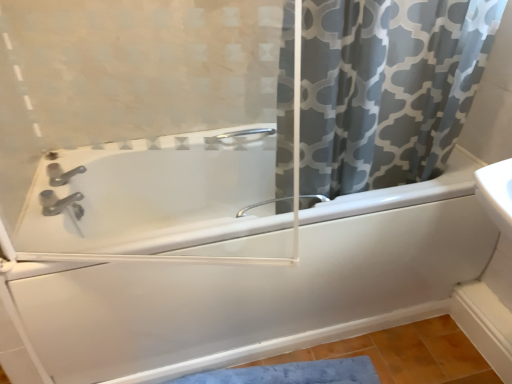
Question: Is satin nickel faucet at lower left aimed at gray printed fabric curtain at upper right?

Choices:
 (A) yes
 (B) no

Answer: (A)

Question: Is satin nickel faucet at lower left wider than gray printed fabric curtain at upper right?

Choices:
 (A) yes
 (B) no

Answer: (B)

Question: Considering the relative positions of satin nickel faucet at lower left and gray printed fabric curtain at upper right in the image provided, is satin nickel faucet at lower left in front of gray printed fabric curtain at upper right?

Choices:
 (A) no
 (B) yes

Answer: (A)

Question: Is the depth of satin nickel faucet at lower left greater than that of gray printed fabric curtain at upper right?

Choices:
 (A) no
 (B) yes

Answer: (B)

Question: From a real-world perspective, is satin nickel faucet at lower left below gray printed fabric curtain at upper right?

Choices:
 (A) no
 (B) yes

Answer: (B)

Question: Can you see satin nickel faucet at lower left touching gray printed fabric curtain at upper right?

Choices:
 (A) yes
 (B) no

Answer: (B)

Question: Is gray printed fabric curtain at upper right beside satin nickel faucet at center?

Choices:
 (A) no
 (B) yes

Answer: (A)

Question: Does gray printed fabric curtain at upper right lie behind satin nickel faucet at center?

Choices:
 (A) yes
 (B) no

Answer: (B)

Question: Could you tell me if gray printed fabric curtain at upper right is facing satin nickel faucet at center?

Choices:
 (A) yes
 (B) no

Answer: (B)

Question: Is gray printed fabric curtain at upper right shorter than satin nickel faucet at center?

Choices:
 (A) no
 (B) yes

Answer: (A)

Question: Is gray printed fabric curtain at upper right closer to camera compared to satin nickel faucet at center?

Choices:
 (A) no
 (B) yes

Answer: (B)

Question: Can you confirm if gray printed fabric curtain at upper right is positioned to the left of satin nickel faucet at center?

Choices:
 (A) no
 (B) yes

Answer: (A)

Question: Are transparent glass screen door at upper center and satin nickel faucet at lower left making contact?

Choices:
 (A) yes
 (B) no

Answer: (B)